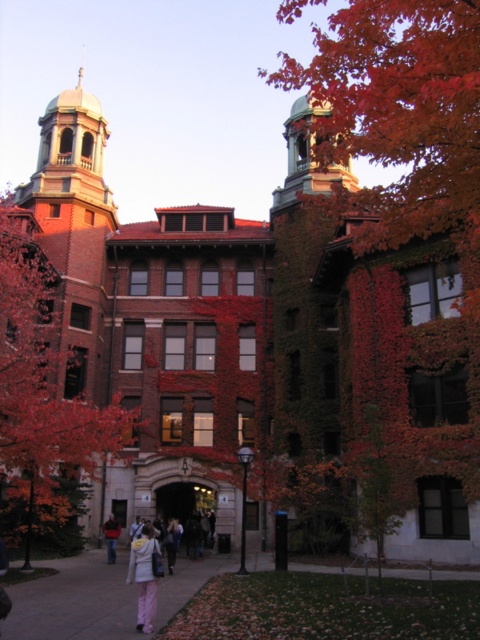
How distant is paved concrete sidewalk at center from dark gray jacket at center?

paved concrete sidewalk at center and dark gray jacket at center are 40.02 feet apart.

Is paved concrete sidewalk at center closer to the viewer compared to dark gray jacket at center?

Yes, paved concrete sidewalk at center is in front of dark gray jacket at center.

This screenshot has height=640, width=480. What are the coordinates of `paved concrete sidewalk at center` in the screenshot? It's located at (74, 602).

Where is `paved concrete sidewalk at center`? This screenshot has height=640, width=480. paved concrete sidewalk at center is located at coordinates (74, 602).

Between white fleece jacket at lower center and dark gray jacket at center, which one has less height?

Standing shorter between the two is dark gray jacket at center.

Does white fleece jacket at lower center have a larger size compared to dark gray jacket at center?

Indeed, white fleece jacket at lower center has a larger size compared to dark gray jacket at center.

Image resolution: width=480 pixels, height=640 pixels. I want to click on white fleece jacket at lower center, so click(144, 576).

Image resolution: width=480 pixels, height=640 pixels. Identify the location of white fleece jacket at lower center. (144, 576).

Looking at this image, is reddish-brown bark tree at left to the right of dark gray jacket at center from the viewer's perspective?

No, reddish-brown bark tree at left is not to the right of dark gray jacket at center.

Between reddish-brown bark tree at left and dark gray jacket at center, which one is positioned lower?

dark gray jacket at center is below.

Is point (50, 348) positioned before point (108, 541)?

No, it is not.

Find the location of a particular element. The height and width of the screenshot is (640, 480). reddish-brown bark tree at left is located at coordinates (44, 387).